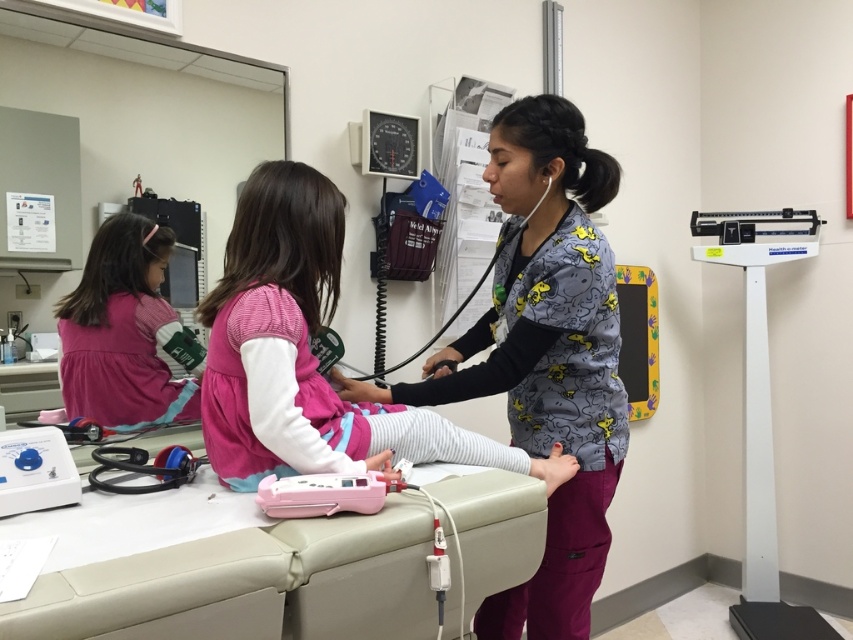
Question: Which point is farther to the camera?

Choices:
 (A) (27, 440)
 (B) (767, 618)
 (C) (430, 387)

Answer: (B)

Question: Is pink fabric dress at center behind white plastic scale at right?

Choices:
 (A) no
 (B) yes

Answer: (A)

Question: Which point appears farthest from the camera in this image?

Choices:
 (A) (779, 250)
 (B) (97, 301)

Answer: (A)

Question: Which of the following is the closest to the observer?

Choices:
 (A) pink fabric dress at center
 (B) pink rubberized medical device at center
 (C) matte plastic stethoscope at lower left
 (D) gray printed scrubs at center

Answer: (B)

Question: Can you confirm if matte plastic stethoscope at lower left is positioned to the right of blue rubber stethoscope at center?

Choices:
 (A) yes
 (B) no

Answer: (B)

Question: Can you confirm if gray printed scrubs at center is positioned below pink rubberized medical device at center?

Choices:
 (A) no
 (B) yes

Answer: (A)